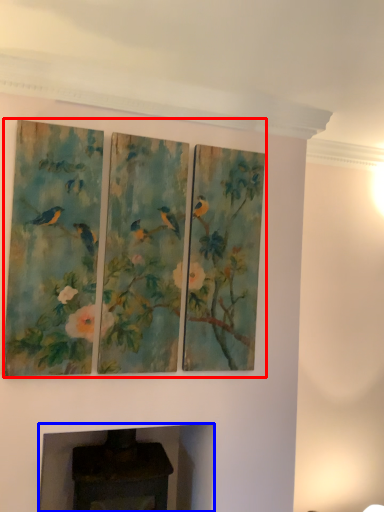
Question: Which of the following is the closest to the observer, oil painting (highlighted by a red box) or fireplace (highlighted by a blue box)?

Choices:
 (A) oil painting
 (B) fireplace

Answer: (A)